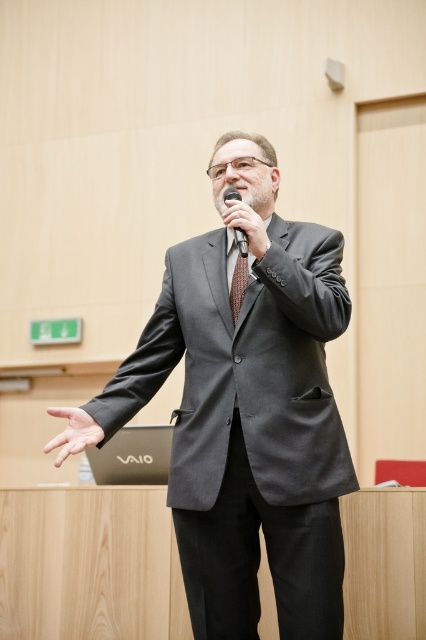
You are a professional photographer setting up for a presentation. You need to ensure that the matte gray suit at center and the smooth skin hand at center are both in focus. Given that your camera can only focus on objects within 20 inches of each other, will both be in focus?

The distance between the matte gray suit at center and the smooth skin hand at center is 20.40 inches. Since the camera requires objects to be within 20 inches of each other for both to be in focus, the distance exceeds the limit by 0.40 inches. Therefore, both objects cannot be in focus simultaneously.

You are an interior designer assessing the layout of this professional room. You notice the brown textured tie at center and the black plastic microphone at upper center. Which object has a narrower width?

The brown textured tie at center has a lesser width compared to the black plastic microphone at upper center, so the brown textured tie at center is narrower.

You are an event coordinator arranging a presentation. You need to ensure the presenter in the matte gray suit at center is positioned correctly relative to the black plastic microphone at upper center. According to the scene, which side of the microphone should the presenter be on?

The matte gray suit at center is to the left of the black plastic microphone at upper center, so the presenter should be positioned to the left side of the microphone.